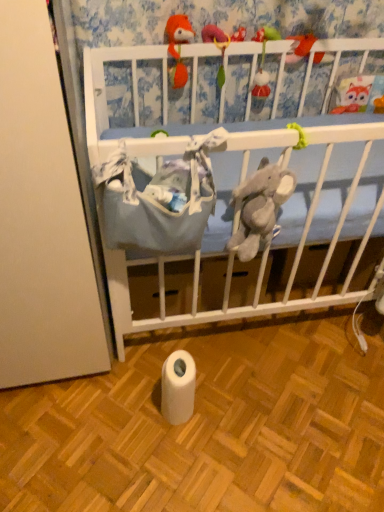
Question: Is white matte toilet paper at lower center looking in the opposite direction of blue fabric crib at upper center?

Choices:
 (A) no
 (B) yes

Answer: (A)

Question: Does white matte toilet paper at lower center have a lesser width compared to blue fabric crib at upper center?

Choices:
 (A) yes
 (B) no

Answer: (B)

Question: Considering the relative sizes of white matte toilet paper at lower center and blue fabric crib at upper center in the image provided, is white matte toilet paper at lower center bigger than blue fabric crib at upper center?

Choices:
 (A) yes
 (B) no

Answer: (B)

Question: Is white matte toilet paper at lower center completely or partially outside of blue fabric crib at upper center?

Choices:
 (A) yes
 (B) no

Answer: (A)

Question: Can you confirm if white matte toilet paper at lower center is positioned to the left of blue fabric crib at upper center?

Choices:
 (A) no
 (B) yes

Answer: (B)

Question: Is blue fabric crib at upper center completely or partially inside white matte toilet paper at lower center?

Choices:
 (A) no
 (B) yes

Answer: (A)

Question: Is matte orange plush at upper center, placed as the 1th toy when sorted from right to left, positioned with its back to blue fabric crib at upper center?

Choices:
 (A) no
 (B) yes

Answer: (B)

Question: Could you tell me if matte orange plush at upper center, placed as the 1th toy when sorted from right to left, is facing blue fabric crib at upper center?

Choices:
 (A) no
 (B) yes

Answer: (A)

Question: Considering the relative sizes of matte orange plush at upper center, placed as the 1th toy when sorted from right to left, and blue fabric crib at upper center in the image provided, is matte orange plush at upper center, placed as the 1th toy when sorted from right to left, taller than blue fabric crib at upper center?

Choices:
 (A) yes
 (B) no

Answer: (B)

Question: Is matte orange plush at upper center, which is the third toy in left-to-right order, placed right next to blue fabric crib at upper center?

Choices:
 (A) yes
 (B) no

Answer: (B)

Question: Is matte orange plush at upper center, placed as the 1th toy when sorted from right to left, smaller than blue fabric crib at upper center?

Choices:
 (A) yes
 (B) no

Answer: (A)

Question: Does matte orange plush at upper center, which is the third toy in left-to-right order, appear on the right side of blue fabric crib at upper center?

Choices:
 (A) yes
 (B) no

Answer: (A)

Question: Does blue fabric crib at upper center have a lesser width compared to matte orange plush at upper center, placed as the 1th toy when sorted from right to left?

Choices:
 (A) no
 (B) yes

Answer: (B)